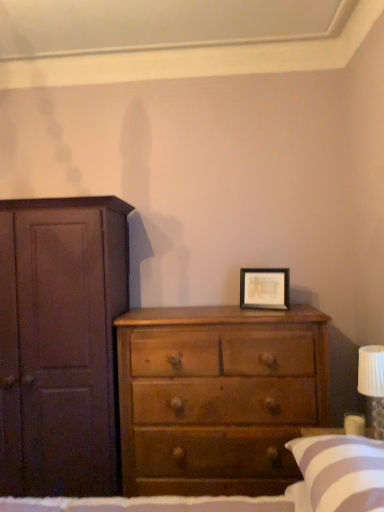
Question: Is wooden framed artwork at center right facing away from matte dark brown cupboard at left?

Choices:
 (A) yes
 (B) no

Answer: (B)

Question: Would you say wooden framed artwork at center right contains matte dark brown cupboard at left?

Choices:
 (A) no
 (B) yes

Answer: (A)

Question: Can you confirm if wooden framed artwork at center right is thinner than matte dark brown cupboard at left?

Choices:
 (A) yes
 (B) no

Answer: (A)

Question: From the image's perspective, is wooden framed artwork at center right under matte dark brown cupboard at left?

Choices:
 (A) yes
 (B) no

Answer: (B)

Question: Is wooden framed artwork at center right taller than matte dark brown cupboard at left?

Choices:
 (A) no
 (B) yes

Answer: (A)

Question: Does wooden framed artwork at center right appear on the right side of matte dark brown cupboard at left?

Choices:
 (A) yes
 (B) no

Answer: (A)

Question: Can you confirm if white striped pillow at lower right is positioned to the right of white pleated fabric at right?

Choices:
 (A) yes
 (B) no

Answer: (B)

Question: Considering the relative sizes of white striped pillow at lower right and white pleated fabric at right in the image provided, is white striped pillow at lower right smaller than white pleated fabric at right?

Choices:
 (A) no
 (B) yes

Answer: (A)

Question: Could you tell me if white striped pillow at lower right is facing white pleated fabric at right?

Choices:
 (A) yes
 (B) no

Answer: (B)

Question: Is white striped pillow at lower right thinner than white pleated fabric at right?

Choices:
 (A) yes
 (B) no

Answer: (B)

Question: From a real-world perspective, is white striped pillow at lower right physically below white pleated fabric at right?

Choices:
 (A) no
 (B) yes

Answer: (B)

Question: From a real-world perspective, does white striped pillow at lower right stand above white pleated fabric at right?

Choices:
 (A) yes
 (B) no

Answer: (B)

Question: From a real-world perspective, is wooden framed artwork at center right beneath white striped pillow at lower right?

Choices:
 (A) no
 (B) yes

Answer: (A)